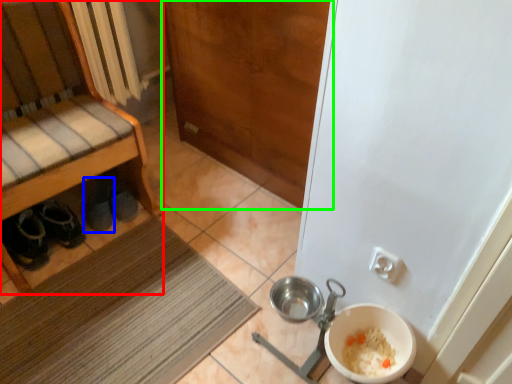
Question: Considering the real-world distances, which object is farthest from cabinetry (highlighted by a red box)? footwear (highlighted by a blue box) or door (highlighted by a green box)?

Choices:
 (A) footwear
 (B) door

Answer: (B)